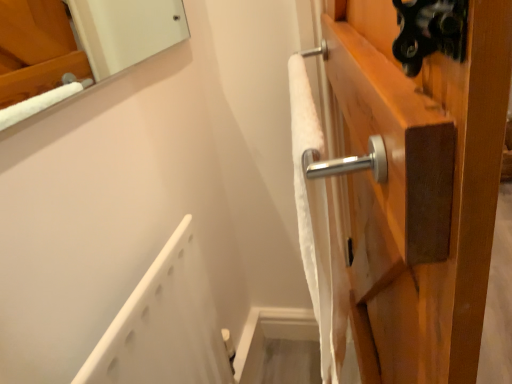
Question: From a real-world perspective, does satin wood door handle at upper right stand above white plastic bath at lower left?

Choices:
 (A) no
 (B) yes

Answer: (A)

Question: From the image's perspective, is satin wood door handle at upper right under white plastic bath at lower left?

Choices:
 (A) no
 (B) yes

Answer: (A)

Question: Is satin wood door handle at upper right further to camera compared to white plastic bath at lower left?

Choices:
 (A) no
 (B) yes

Answer: (B)

Question: Does satin wood door handle at upper right appear on the right side of white plastic bath at lower left?

Choices:
 (A) no
 (B) yes

Answer: (B)

Question: Is satin wood door handle at upper right directly adjacent to white plastic bath at lower left?

Choices:
 (A) yes
 (B) no

Answer: (B)

Question: Does satin wood door handle at upper right turn towards white plastic bath at lower left?

Choices:
 (A) yes
 (B) no

Answer: (B)

Question: Is white plastic bath at lower left next to satin wood door handle at upper right and touching it?

Choices:
 (A) no
 (B) yes

Answer: (A)

Question: Considering the relative sizes of white plastic bath at lower left and satin wood door handle at upper right in the image provided, is white plastic bath at lower left smaller than satin wood door handle at upper right?

Choices:
 (A) yes
 (B) no

Answer: (A)

Question: From a real-world perspective, is white plastic bath at lower left located higher than satin wood door handle at upper right?

Choices:
 (A) no
 (B) yes

Answer: (B)

Question: Can you confirm if white plastic bath at lower left is shorter than satin wood door handle at upper right?

Choices:
 (A) no
 (B) yes

Answer: (A)

Question: Is white plastic bath at lower left to the left of satin wood door handle at upper right from the viewer's perspective?

Choices:
 (A) no
 (B) yes

Answer: (B)

Question: Does white plastic bath at lower left have a larger size compared to satin wood door handle at upper right?

Choices:
 (A) no
 (B) yes

Answer: (A)

Question: Is white soft towel at upper right at the back of satin wood door handle at upper right?

Choices:
 (A) yes
 (B) no

Answer: (B)